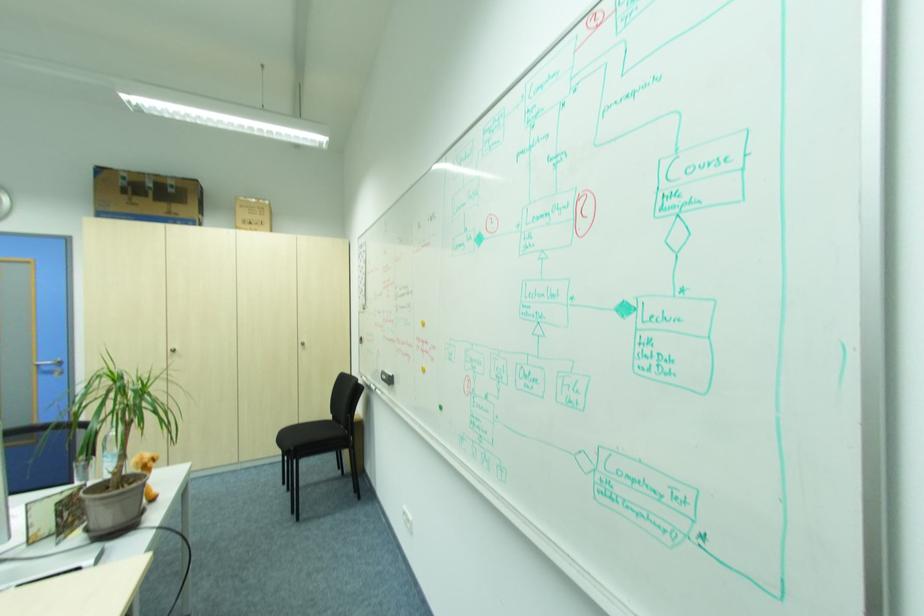
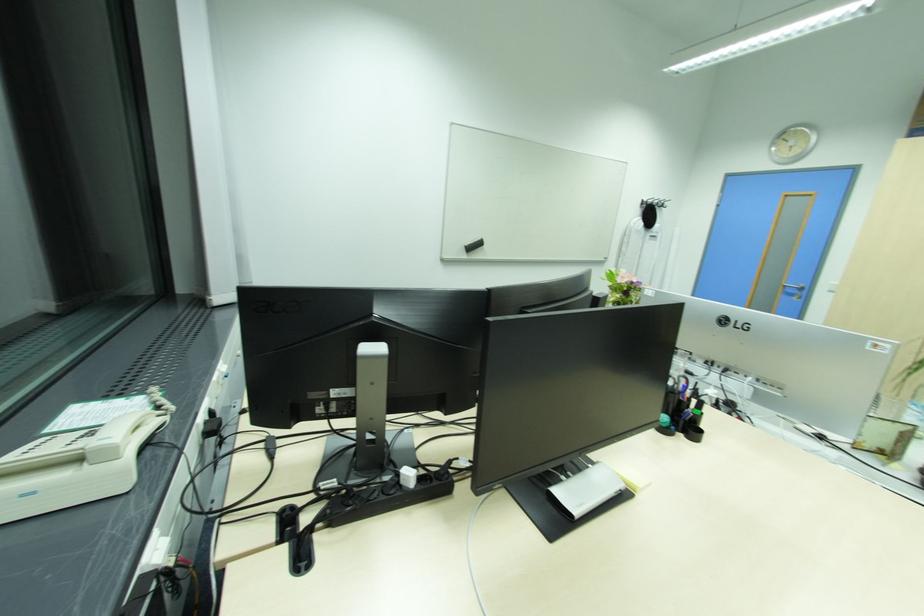
The first image is from the beginning of the video and the second image is from the end. How did the camera likely rotate when shooting the video?

The camera rotated toward left-down.